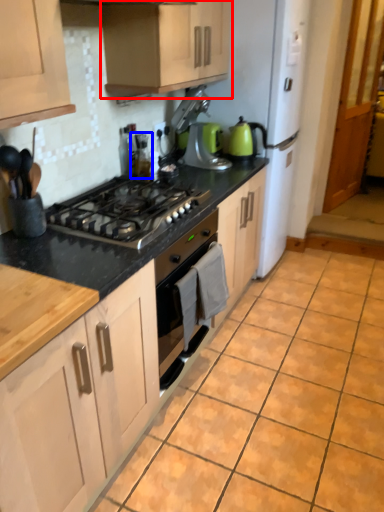
Question: Which point is closer to the camera, cabinetry (highlighted by a red box) or appliance (highlighted by a blue box)?

Choices:
 (A) cabinetry
 (B) appliance

Answer: (A)